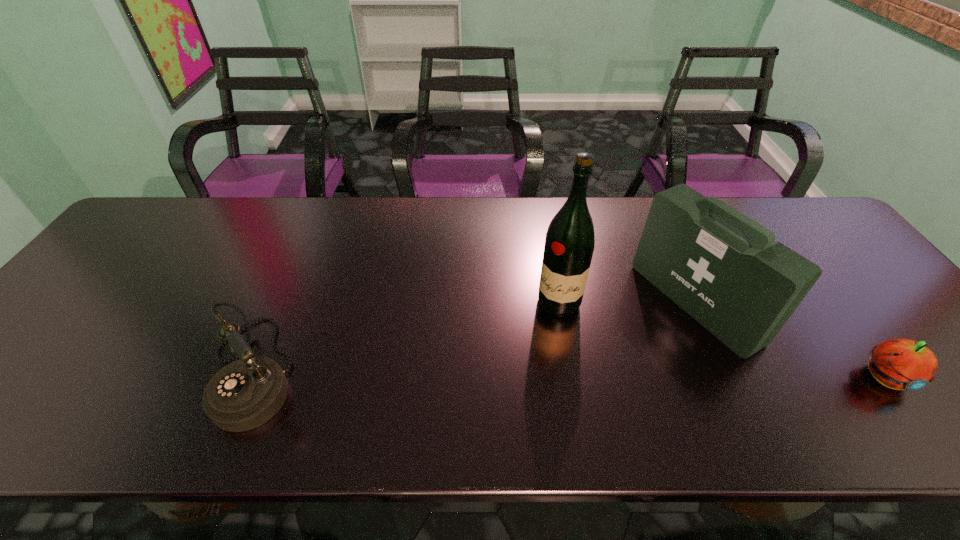
Locate an element on the screen. telephone is located at coordinates (246, 393).

The image size is (960, 540). Identify the location of the leftmost object. (246, 393).

Identify the location of the rightmost object. (902, 364).

The image size is (960, 540). I want to click on apple, so click(902, 364).

Identify the location of the second object from right to left. This screenshot has width=960, height=540. (724, 269).

Locate an element on the screen. Image resolution: width=960 pixels, height=540 pixels. the third shortest object is located at coordinates (724, 269).

The image size is (960, 540). I want to click on the tallest object, so coord(569,244).

Where is `the third object from right to left`? The width and height of the screenshot is (960, 540). the third object from right to left is located at coordinates (569, 244).

Find the location of a particular element. The image size is (960, 540). blank space located on the left of the third tallest object is located at coordinates (99, 369).

Identify the location of free spot located on the front-facing side of the second object from right to left. (565, 384).